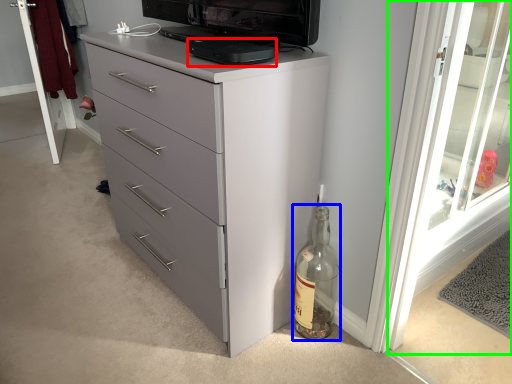
Question: Based on their relative distances, which object is nearer to appliance (highlighted by a red box)? Choose from glass bottle (highlighted by a blue box) and screen door (highlighted by a green box).

Choices:
 (A) glass bottle
 (B) screen door

Answer: (A)